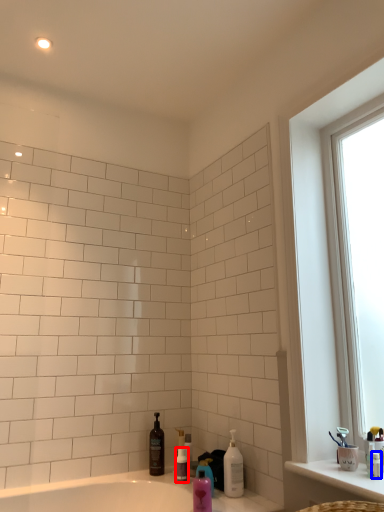
Question: Among these objects, which one is farthest to the camera, toiletry (highlighted by a red box) or toiletry (highlighted by a blue box)?

Choices:
 (A) toiletry
 (B) toiletry

Answer: (A)